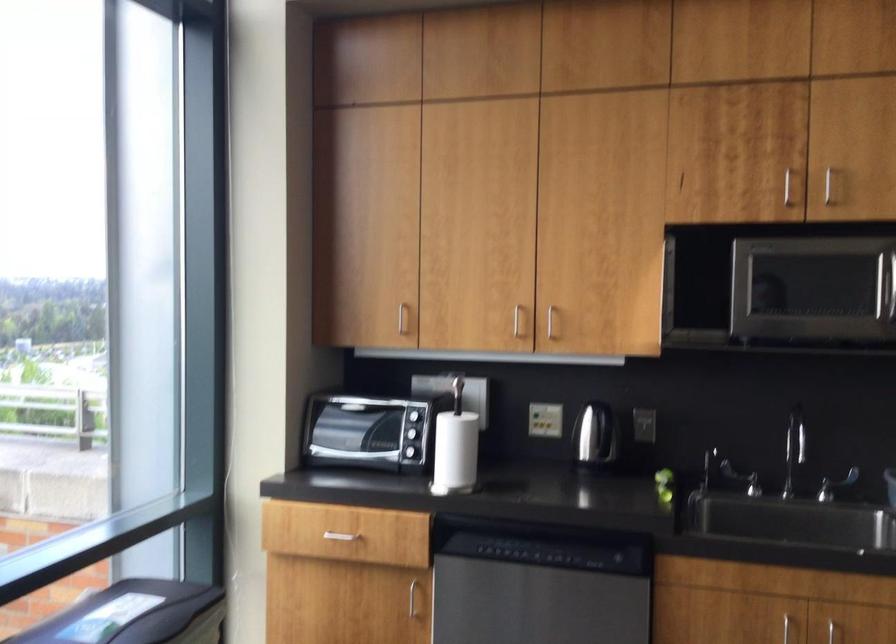
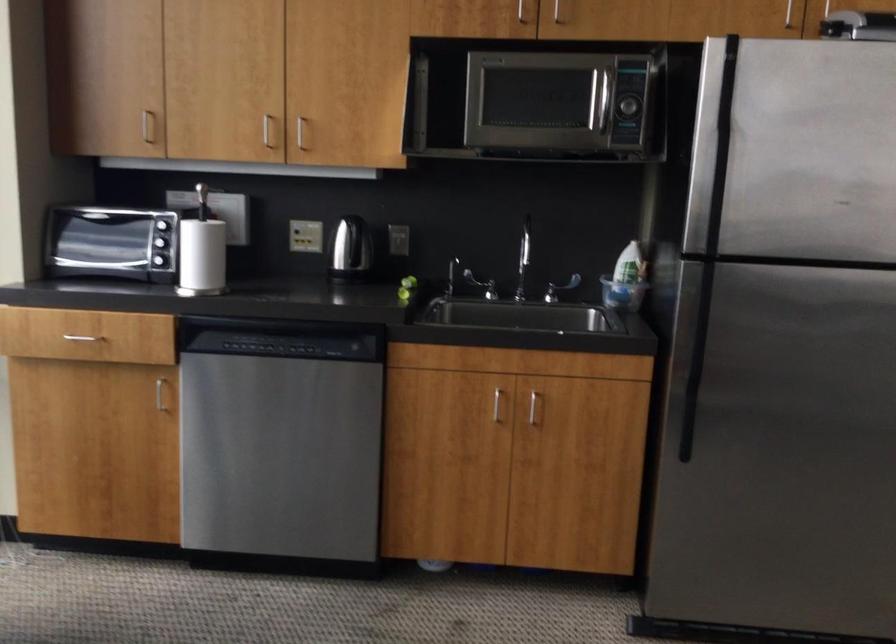
Locate, in the second image, the point that corresponds to point 746,478 in the first image.

(480, 285)